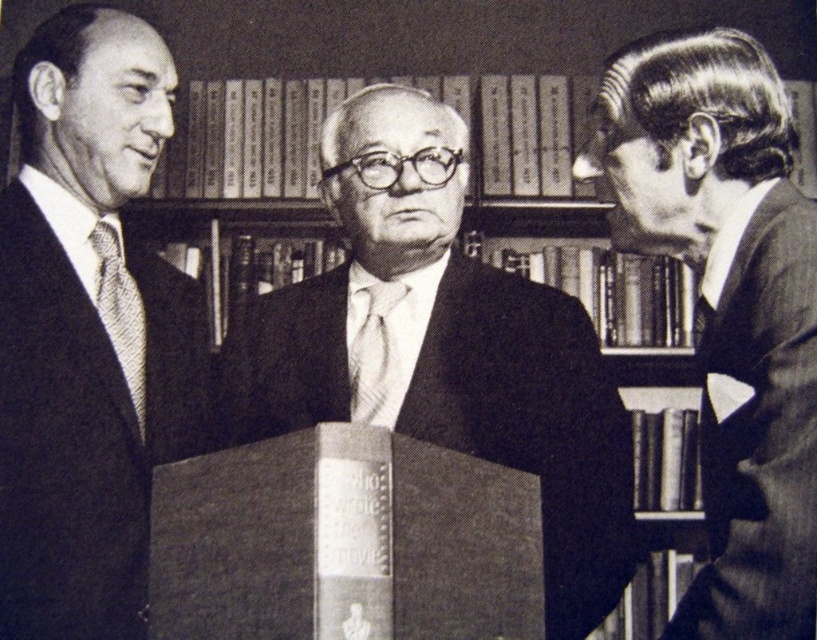
You are a GUI agent. You are given a task and a screenshot of the screen. Output one action in this format:
    pyautogui.click(x=<x>, y=<y>)
    Task: Click on the matte black suit at left
    Image resolution: width=817 pixels, height=640 pixels.
    Given the screenshot: What is the action you would take?
    pyautogui.click(x=88, y=332)

Is point (199, 397) farther from viewer compared to point (753, 132)?

That is True.

Image resolution: width=817 pixels, height=640 pixels. What are the coordinates of `matte black suit at left` in the screenshot? It's located at (88, 332).

Does matte black suit at left have a larger size compared to dark gray wool suit at right?

Yes.

Find the location of a particular element. matte black suit at left is located at coordinates (88, 332).

Who is more forward, (x=32, y=586) or (x=731, y=634)?

Point (x=731, y=634)

At what (x,y) coordinates should I click in order to perform the action: click on matte black suit at left. Please return your answer as a coordinate pair (x, y). The width and height of the screenshot is (817, 640). Looking at the image, I should click on (88, 332).

Is smooth black suit at center wider than white textured tie at center?

Yes.

Is smooth black suit at center smaller than white textured tie at center?

No, smooth black suit at center is not smaller than white textured tie at center.

Identify the location of smooth black suit at center. (445, 346).